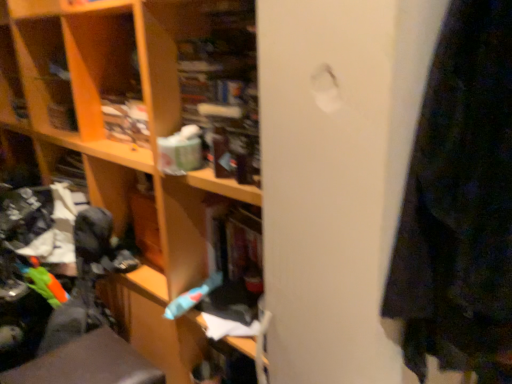
Question: From the image's perspective, is metallic gray swivel chair at lower left below rubberized blue toothbrush at center?

Choices:
 (A) no
 (B) yes

Answer: (B)

Question: Is metallic gray swivel chair at lower left positioned before rubberized blue toothbrush at center?

Choices:
 (A) no
 (B) yes

Answer: (B)

Question: Is metallic gray swivel chair at lower left turned away from rubberized blue toothbrush at center?

Choices:
 (A) yes
 (B) no

Answer: (B)

Question: Is metallic gray swivel chair at lower left not close to rubberized blue toothbrush at center?

Choices:
 (A) yes
 (B) no

Answer: (B)

Question: Considering the relative positions of metallic gray swivel chair at lower left and rubberized blue toothbrush at center in the image provided, is metallic gray swivel chair at lower left to the right of rubberized blue toothbrush at center from the viewer's perspective?

Choices:
 (A) no
 (B) yes

Answer: (A)

Question: Does metallic gray swivel chair at lower left lie behind rubberized blue toothbrush at center?

Choices:
 (A) no
 (B) yes

Answer: (A)

Question: Does rubberized blue toothbrush at center appear on the right side of metallic gray swivel chair at lower left?

Choices:
 (A) no
 (B) yes

Answer: (B)

Question: Is rubberized blue toothbrush at center positioned in front of metallic gray swivel chair at lower left?

Choices:
 (A) no
 (B) yes

Answer: (A)

Question: Is rubberized blue toothbrush at center outside of metallic gray swivel chair at lower left?

Choices:
 (A) no
 (B) yes

Answer: (B)

Question: Can you confirm if rubberized blue toothbrush at center is smaller than metallic gray swivel chair at lower left?

Choices:
 (A) no
 (B) yes

Answer: (B)

Question: Does rubberized blue toothbrush at center have a greater height compared to metallic gray swivel chair at lower left?

Choices:
 (A) no
 (B) yes

Answer: (A)

Question: From a real-world perspective, is rubberized blue toothbrush at center located higher than metallic gray swivel chair at lower left?

Choices:
 (A) yes
 (B) no

Answer: (A)

Question: Based on their positions, is metallic gray swivel chair at lower left located to the left or right of rubberized blue toothbrush at center?

Choices:
 (A) right
 (B) left

Answer: (B)